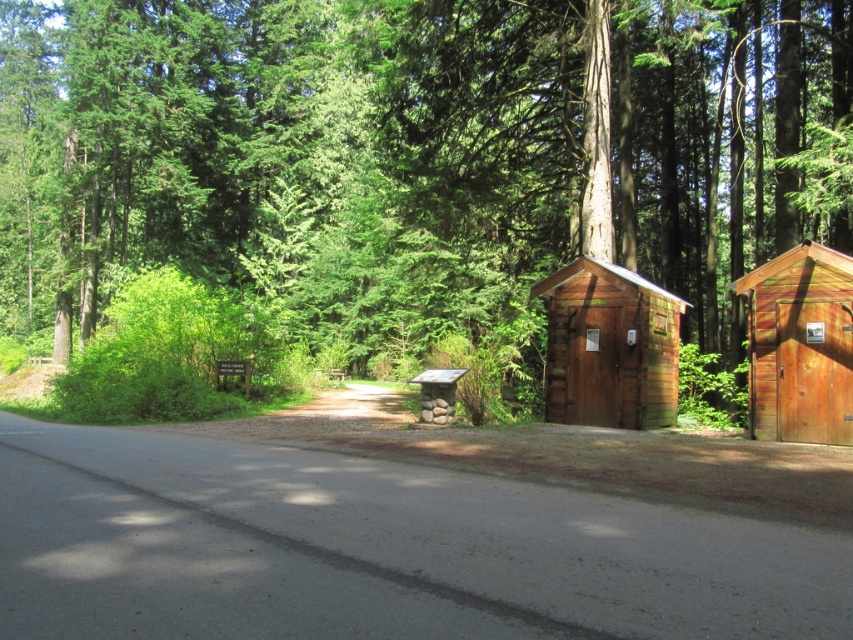
Question: Where is wooden cabin at center located in relation to wooden cabin at right in the image?

Choices:
 (A) above
 (B) below

Answer: (B)

Question: Which of the following is the farthest from the observer?

Choices:
 (A) (675, 282)
 (B) (759, 348)

Answer: (A)

Question: Which point is farther to the camera?

Choices:
 (A) (642, 348)
 (B) (523, 259)

Answer: (B)

Question: Estimate the real-world distances between objects in this image. Which object is farther from the wooden cabin at center?

Choices:
 (A) brown wooden shed at right
 (B) wooden cabin at right

Answer: (A)

Question: Does brown wooden shed at right have a larger size compared to wooden cabin at center?

Choices:
 (A) no
 (B) yes

Answer: (B)

Question: Can you confirm if brown wooden shed at right is wider than wooden cabin at right?

Choices:
 (A) yes
 (B) no

Answer: (A)